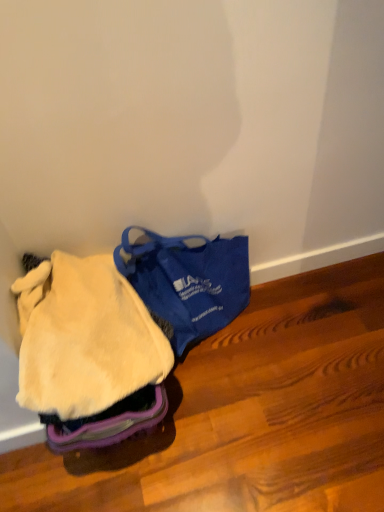
Question: In the image, is blue fabric bag at center on the left side or the right side of fuzzy yellow blanket at lower left?

Choices:
 (A) right
 (B) left

Answer: (A)

Question: Which is correct: blue fabric bag at center is inside fuzzy yellow blanket at lower left, or outside of it?

Choices:
 (A) outside
 (B) inside

Answer: (A)

Question: In terms of size, does blue fabric bag at center appear bigger or smaller than fuzzy yellow blanket at lower left?

Choices:
 (A) big
 (B) small

Answer: (A)

Question: From a real-world perspective, is fuzzy yellow blanket at lower left above or below blue fabric bag at center?

Choices:
 (A) below
 (B) above

Answer: (B)

Question: From the image's perspective, is fuzzy yellow blanket at lower left positioned above or below blue fabric bag at center?

Choices:
 (A) above
 (B) below

Answer: (B)

Question: Considering the positions of point (54, 284) and point (246, 300), is point (54, 284) closer or farther from the camera than point (246, 300)?

Choices:
 (A) closer
 (B) farther

Answer: (A)

Question: Considering the positions of fuzzy yellow blanket at lower left and blue fabric bag at center in the image, is fuzzy yellow blanket at lower left bigger or smaller than blue fabric bag at center?

Choices:
 (A) big
 (B) small

Answer: (B)